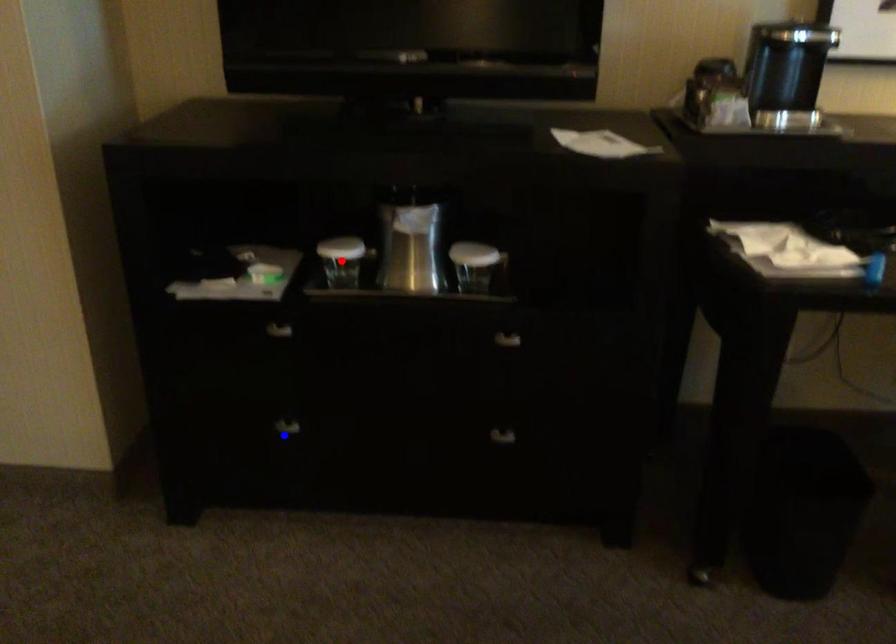
Question: Two points are marked on the image. Which point is closer to the camera?

Choices:
 (A) Blue point is closer.
 (B) Red point is closer.

Answer: (B)